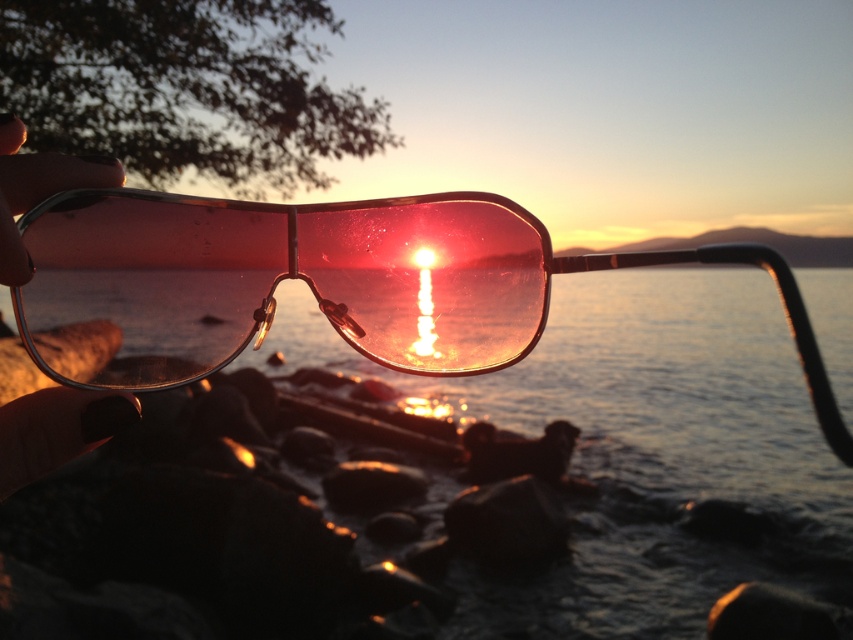
Who is more forward, (602, 592) or (61, 257)?

Point (61, 257) is more forward.

Does translucent water at center appear on the left side of transparent plastic goggles at center?

In fact, translucent water at center is to the right of transparent plastic goggles at center.

Does point (689, 340) come farther from viewer compared to point (73, 332)?

Yes, point (689, 340) is farther from viewer.

The image size is (853, 640). I want to click on translucent water at center, so click(643, 388).